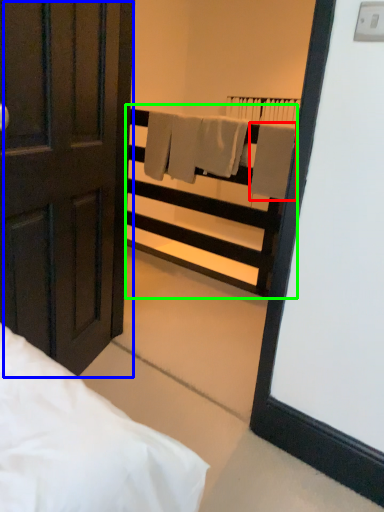
Question: Estimate the real-world distances between objects in this image. Which object is closer to bath towel (highlighted by a red box), door (highlighted by a blue box) or balustrade (highlighted by a green box)?

Choices:
 (A) door
 (B) balustrade

Answer: (B)